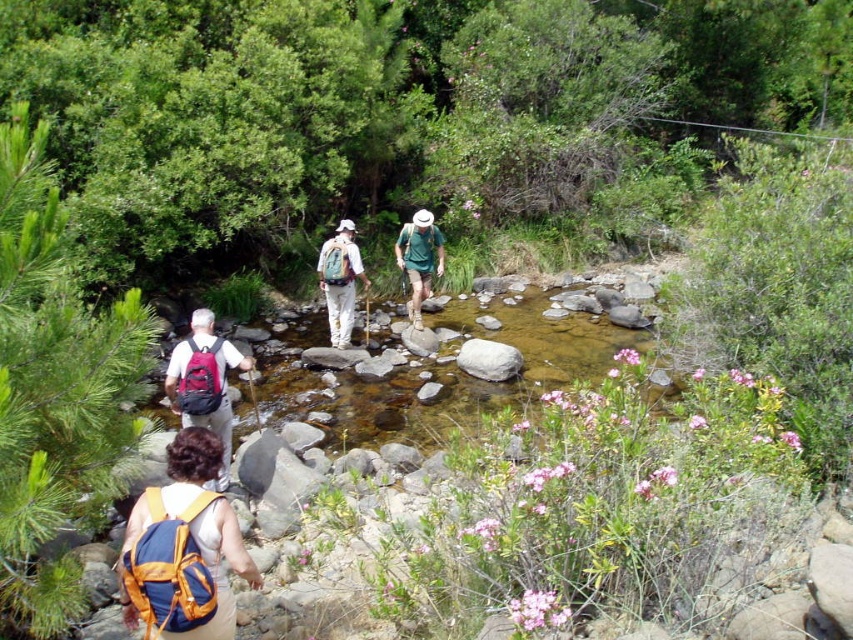
You are a hiker trying to locate your lost white matte backpack at center in the forest. Based on the coordinates provided, can you determine its exact location relative to the stream?

The white matte backpack at center is located at coordinates point (x=340, y=282), which places it in the center of the image, likely on the rocks near the stream where the hikers are crossing.

You are a hiker trying to cross the stream. You see the clear water at center and the white matte backpack at center. How far apart are these two items?

The distance between the clear water at center and the white matte backpack at center is 7.05 feet.

You are a hiker looking at the scene. You see the white matte backpack at center and the green fabric shirt at center. Which object is lower in position?

The white matte backpack at center is below green fabric shirt at center, so the white matte backpack at center is lower.